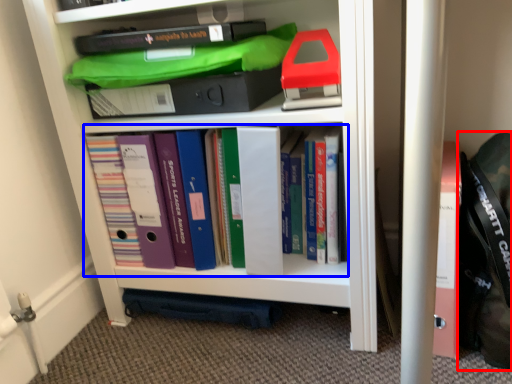
Question: Which object is further to the camera taking this photo, messenger bag (highlighted by a red box) or book (highlighted by a blue box)?

Choices:
 (A) messenger bag
 (B) book

Answer: (B)